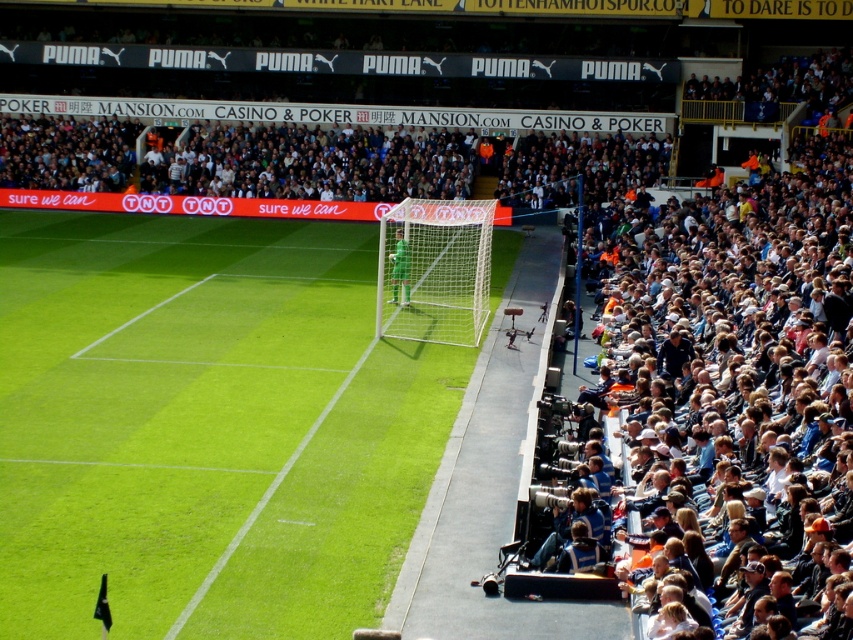
Question: Which object is the closest to the green jersey at center?

Choices:
 (A) green grass at center
 (B) white net at center

Answer: (B)

Question: Which point appears farthest from the camera in this image?

Choices:
 (A) (134, 612)
 (B) (407, 282)

Answer: (B)

Question: Which object is closer to the camera taking this photo?

Choices:
 (A) green grass at center
 (B) white net at center

Answer: (A)

Question: Is green grass at center bigger than white net at center?

Choices:
 (A) yes
 (B) no

Answer: (A)

Question: Does green grass at center have a larger size compared to white net at center?

Choices:
 (A) yes
 (B) no

Answer: (A)

Question: Can you confirm if green grass at center is positioned to the left of green jersey at center?

Choices:
 (A) no
 (B) yes

Answer: (B)